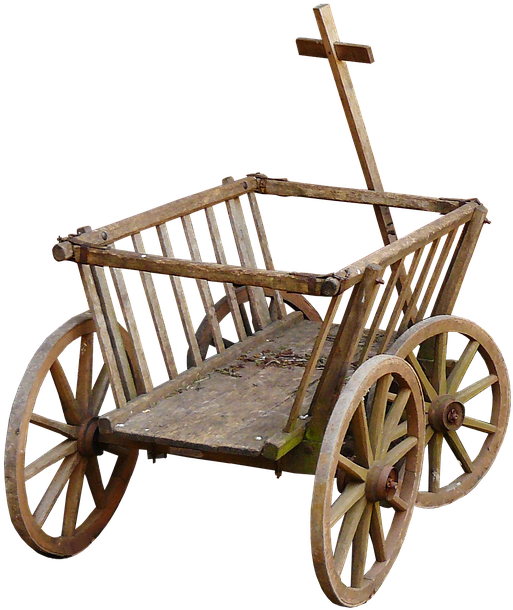
At what (x,y) coordinates should I click in order to perform the action: click on long brown board. Please return your answer as a coordinate pair (x, y). Image resolution: width=513 pixels, height=610 pixels. Looking at the image, I should click on (367, 157).